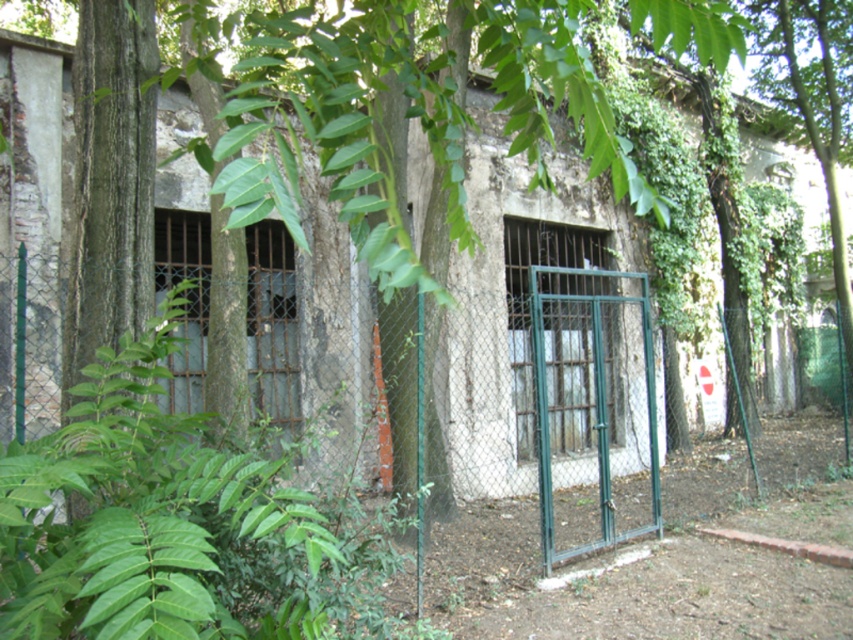
You are a maintenance worker who needs to reach the green metal gate at center. There is a green leafy plant at center blocking your path. Can you walk around it without stepping on the plant?

The green leafy plant at center is 3.41 meters away from the green metal gate at center, so there is enough space to walk around the plant without stepping on it.

You are a maintenance worker needing to access the green metal gate at center. There is a green leafy plant at center blocking your path. Which direction should you move to avoid it?

The green leafy plant at center is to the left of the green metal gate at center, so you should move to the right to avoid it.

You are a maintenance worker needing to access the green metal gate at center. There is a green leafy plant at center blocking your path. Can you walk through the area between them?

The green leafy plant at center is in front of the green metal gate at center, so there is no space between them for you to walk through.